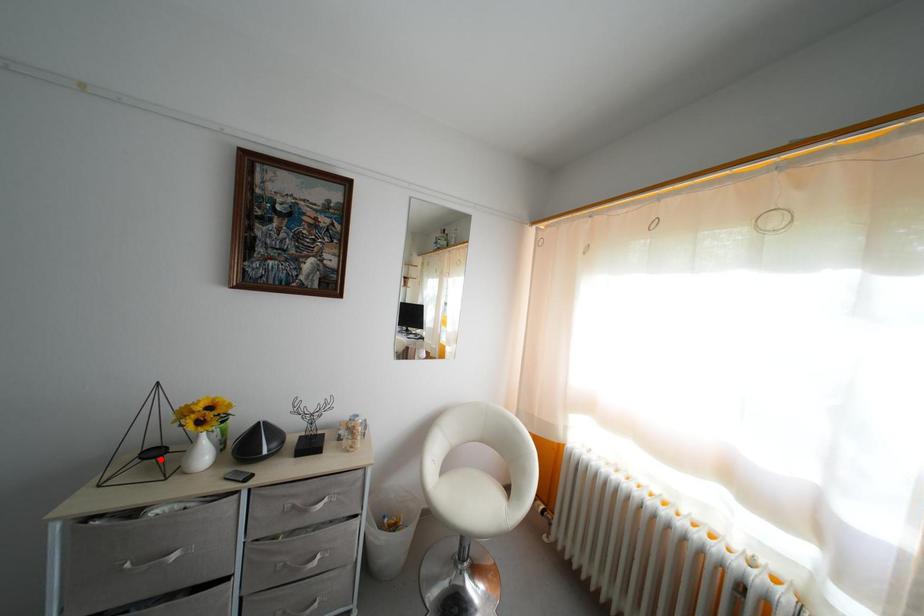
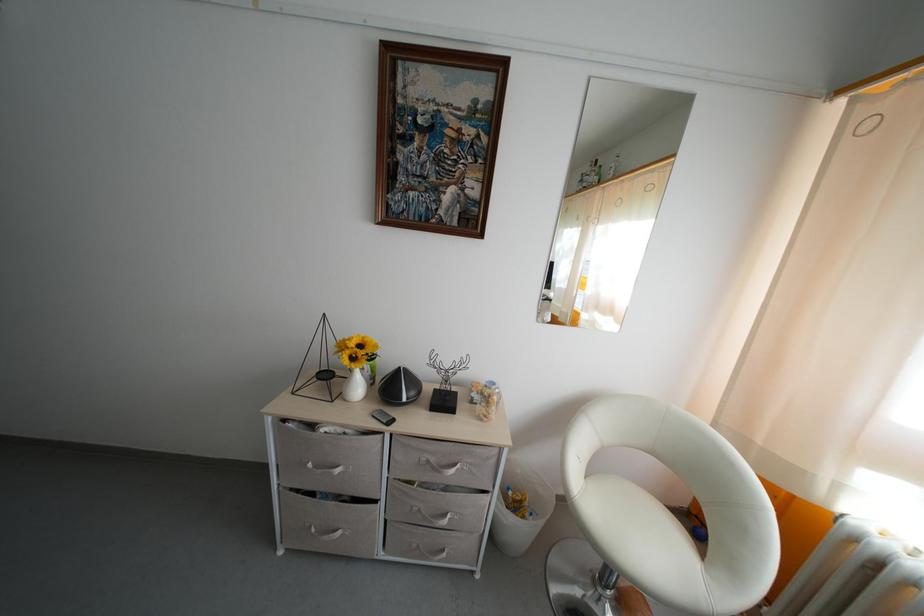
Question: I am providing you with two images of the same scene from different viewpoints. A red point is shown in image1. For the corresponding object point in image2, is it positioned nearer or farther from the camera?

Choices:
 (A) Nearer
 (B) Farther

Answer: (B)